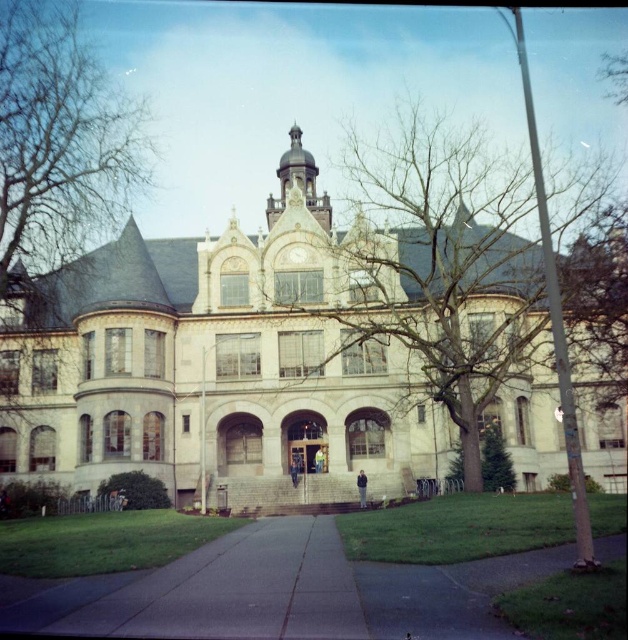
Does white stone mansion at center appear over smooth asphalt path at center?

Indeed, white stone mansion at center is positioned over smooth asphalt path at center.

Which is in front, point (192, 305) or point (106, 596)?

Point (106, 596) is more forward.

You are a GUI agent. You are given a task and a screenshot of the screen. Output one action in this format:
    pyautogui.click(x=<x>, y=<y>)
    Task: Click on the white stone mansion at center
    This screenshot has width=628, height=640.
    Given the screenshot: What is the action you would take?
    pyautogui.click(x=214, y=365)

Image resolution: width=628 pixels, height=640 pixels. I want to click on white stone mansion at center, so click(214, 365).